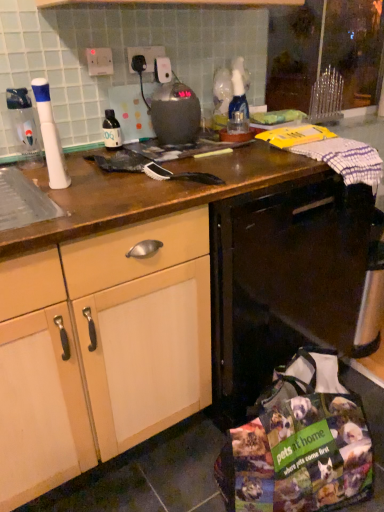
Question: Could metallic gray kettle at center be considered to be inside white plastic toothbrush at left?

Choices:
 (A) yes
 (B) no

Answer: (B)

Question: Is white plastic toothbrush at left placed right next to metallic gray kettle at center?

Choices:
 (A) no
 (B) yes

Answer: (A)

Question: Can you confirm if white plastic toothbrush at left is shorter than metallic gray kettle at center?

Choices:
 (A) no
 (B) yes

Answer: (A)

Question: From a real-world perspective, is white plastic toothbrush at left positioned over metallic gray kettle at center based on gravity?

Choices:
 (A) yes
 (B) no

Answer: (A)

Question: Can you confirm if white plastic toothbrush at left is bigger than metallic gray kettle at center?

Choices:
 (A) no
 (B) yes

Answer: (A)

Question: Is point (246, 306) positioned closer to the camera than point (33, 92)?

Choices:
 (A) closer
 (B) farther

Answer: (B)

Question: From the image's perspective, is black glossy dishwasher at center positioned above or below white plastic toothbrush at left?

Choices:
 (A) above
 (B) below

Answer: (B)

Question: In terms of height, does black glossy dishwasher at center look taller or shorter compared to white plastic toothbrush at left?

Choices:
 (A) tall
 (B) short

Answer: (A)

Question: Based on their positions, is black glossy dishwasher at center located to the left or right of white plastic toothbrush at left?

Choices:
 (A) right
 (B) left

Answer: (A)

Question: Is point (274, 245) positioned closer to the camera than point (112, 121)?

Choices:
 (A) closer
 (B) farther

Answer: (A)

Question: In terms of size, does black glossy dishwasher at center appear bigger or smaller than matte black bottle at center, acting as the 1th bottle starting from the right?

Choices:
 (A) small
 (B) big

Answer: (B)

Question: In terms of height, does black glossy dishwasher at center look taller or shorter compared to matte black bottle at center, arranged as the 1th bottle when viewed from the back?

Choices:
 (A) tall
 (B) short

Answer: (A)

Question: Would you say black glossy dishwasher at center is inside or outside matte black bottle at center, acting as the 1th bottle starting from the right?

Choices:
 (A) inside
 (B) outside

Answer: (B)

Question: Considering the positions of transparent plastic bottle at left, the 1th bottle positioned from the left, and metallic gray kettle at center in the image, is transparent plastic bottle at left, the 1th bottle positioned from the left, taller or shorter than metallic gray kettle at center?

Choices:
 (A) tall
 (B) short

Answer: (A)

Question: From a real-world perspective, relative to metallic gray kettle at center, is transparent plastic bottle at left, which is the 1th bottle from front to back, vertically above or below?

Choices:
 (A) below
 (B) above

Answer: (A)